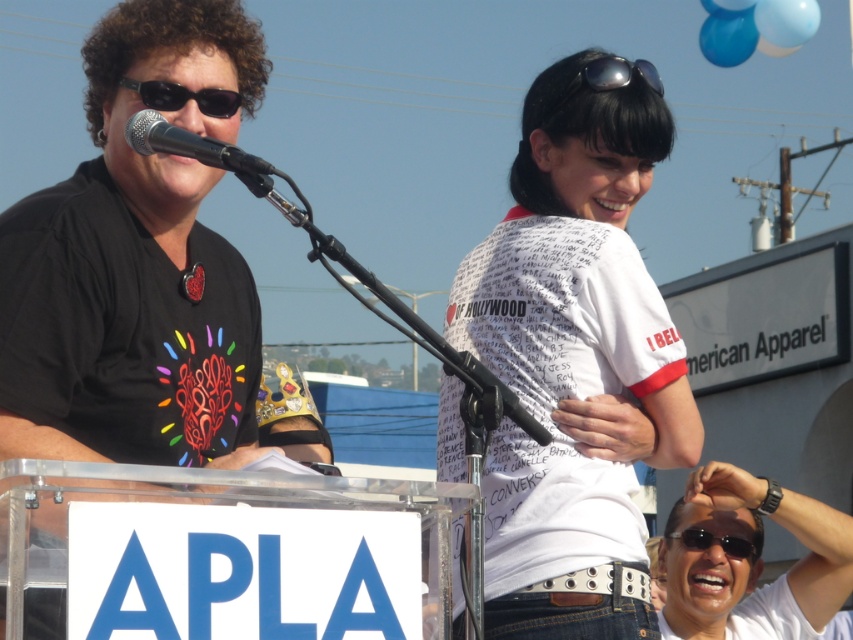
Does white printed t-shirt at center have a lesser height compared to black plastic sunglasses at lower center?

No.

Between point (502, 637) and point (758, 536), which one is positioned behind?

The point (758, 536) is more distant.

I want to click on white printed t-shirt at center, so click(x=578, y=262).

Is sunglasses at upper center taller than black plastic sunglasses at lower center?

Incorrect, sunglasses at upper center's height is not larger of black plastic sunglasses at lower center's.

Who is lower down, sunglasses at upper center or black plastic sunglasses at lower center?

black plastic sunglasses at lower center is lower down.

What do you see at coordinates (619, 74) in the screenshot? I see `sunglasses at upper center` at bounding box center [619, 74].

This screenshot has width=853, height=640. I want to click on sunglasses at upper center, so click(x=619, y=74).

Describe the element at coordinates (184, 97) in the screenshot. I see `black plastic sunglasses at left` at that location.

Is the position of black plastic sunglasses at left less distant than that of sunglasses at upper center?

Yes, it is in front of sunglasses at upper center.

What do you see at coordinates (184, 97) in the screenshot?
I see `black plastic sunglasses at left` at bounding box center [184, 97].

Find the location of a particular element. The image size is (853, 640). black plastic sunglasses at left is located at coordinates (184, 97).